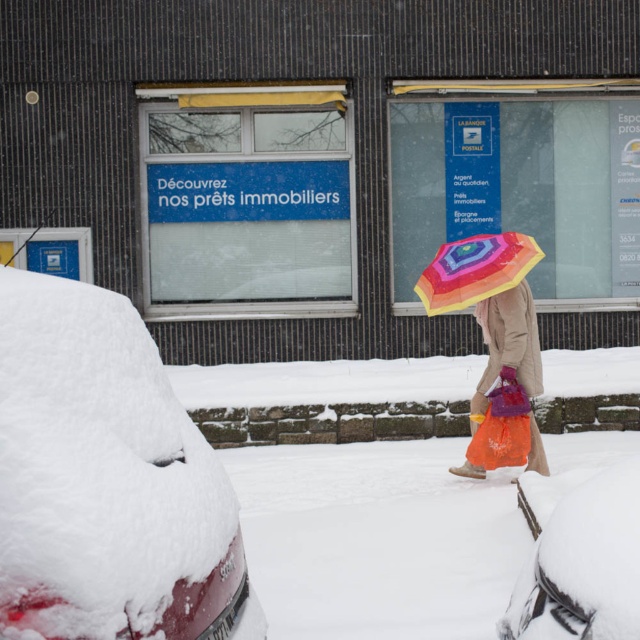
Is point (532, 326) positioned in front of point (515, 253)?

No, (532, 326) is behind (515, 253).

Does rainbow plastic umbrella at center have a smaller size compared to rainbow fabric umbrella at center?

Incorrect, rainbow plastic umbrella at center is not smaller in size than rainbow fabric umbrella at center.

At what (x,y) coordinates should I click in order to perform the action: click on rainbow plastic umbrella at center. Please return your answer as a coordinate pair (x, y). Image resolution: width=640 pixels, height=640 pixels. Looking at the image, I should click on (508, 346).

Between point (20, 419) and point (529, 237), which one is positioned behind?

The point (529, 237) is behind.

Who is positioned more to the left, snow-covered car at left or rainbow fabric umbrella at center?

Positioned to the left is snow-covered car at left.

Is point (61, 337) closer to viewer compared to point (449, 266)?

Yes, it is.

Locate an element on the screen. Image resolution: width=640 pixels, height=640 pixels. snow-covered car at left is located at coordinates (106, 481).

Which is in front, point (596, 525) or point (531, 372)?

Point (596, 525) is more forward.

Measure the distance between point [524,598] and camera.

A distance of 4.71 meters exists between point [524,598] and camera.

The width and height of the screenshot is (640, 640). Identify the location of snow-covered car at lower right. (582, 564).

Locate an element on the screen. snow-covered car at lower right is located at coordinates [582, 564].